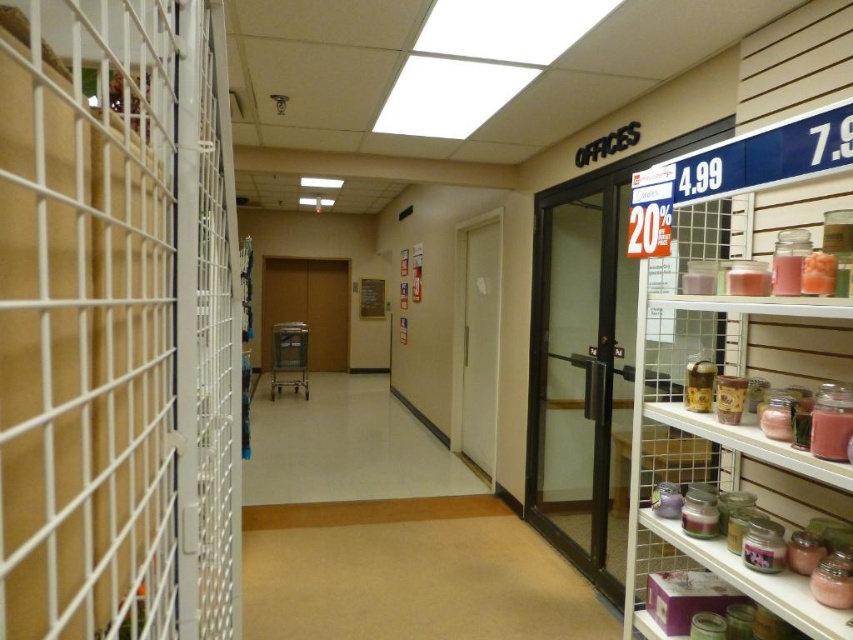
You are trying to decide whether to place a large decorative plant in the white wire mesh cage at left or the pink glass jars at right. Based on their sizes, which location can accommodate the plant better?

The white wire mesh cage at left might be wider than pink glass jars at right, so it can accommodate the plant better.

You are a customer in the store and want to pick up both the white wire mesh cage at left and the pink glass jars at right. Which item should you move towards first based on their positions?

You should move towards the white wire mesh cage at left first since it is located to the left of the pink glass jars at right, meaning it is closer to your current position if you are approaching from the center of the store.